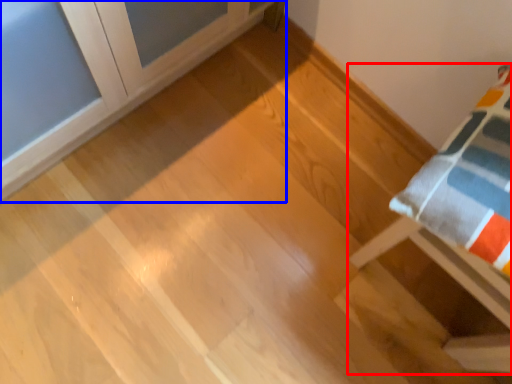
Question: Which point is closer to the camera, furniture (highlighted by a red box) or furniture (highlighted by a blue box)?

Choices:
 (A) furniture
 (B) furniture

Answer: (B)